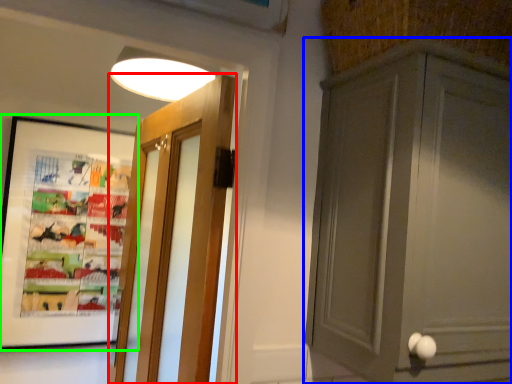
Question: Considering the real-world distances, which object is farthest from door (highlighted by a red box)? cabinetry (highlighted by a blue box) or picture frame (highlighted by a green box)?

Choices:
 (A) cabinetry
 (B) picture frame

Answer: (A)